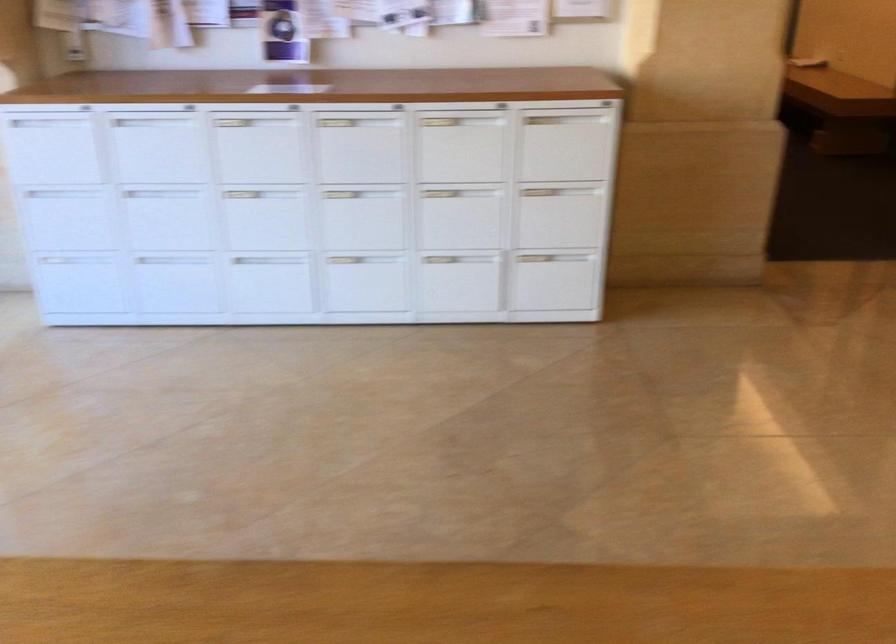
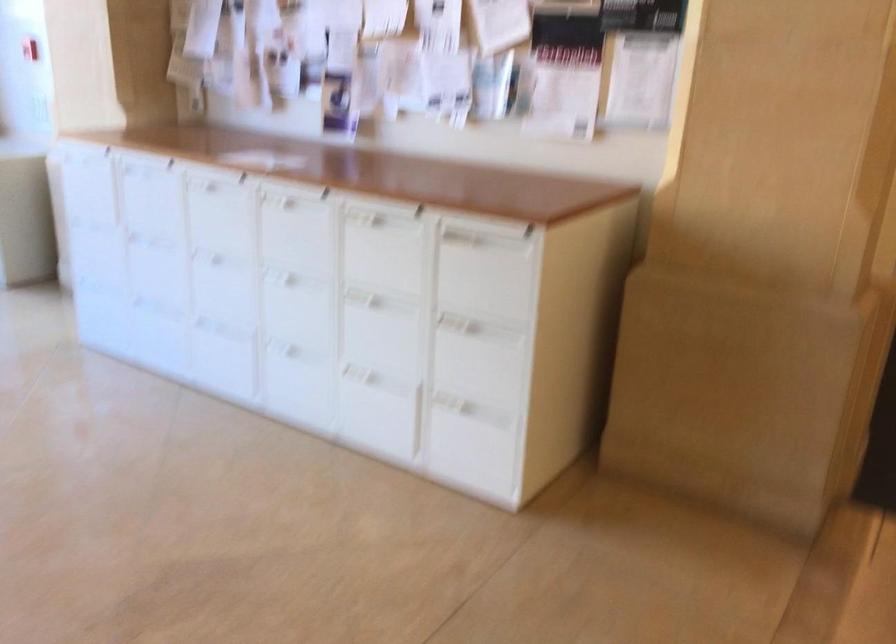
The point at (357, 144) is marked in the first image. Where is the corresponding point in the second image?

(295, 228)